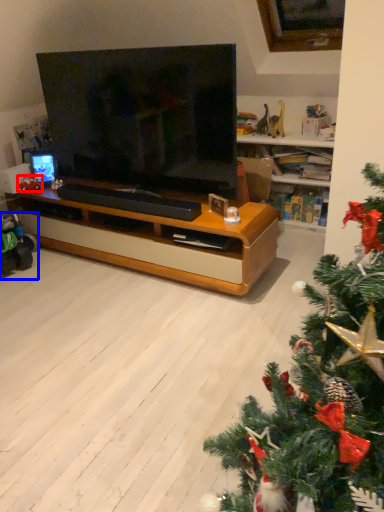
Question: Which object appears farthest to the camera in this image, toy (highlighted by a red box) or toy (highlighted by a blue box)?

Choices:
 (A) toy
 (B) toy

Answer: (A)